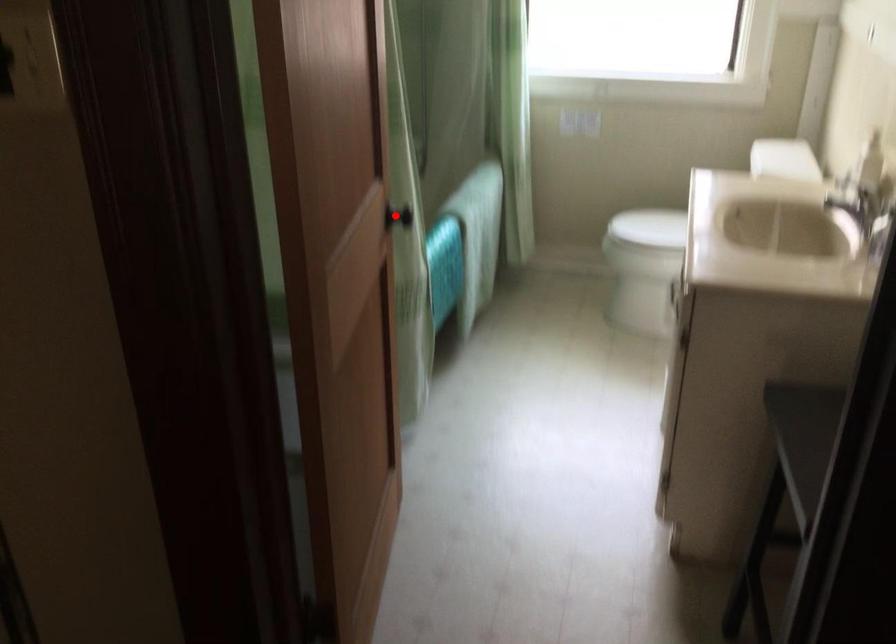
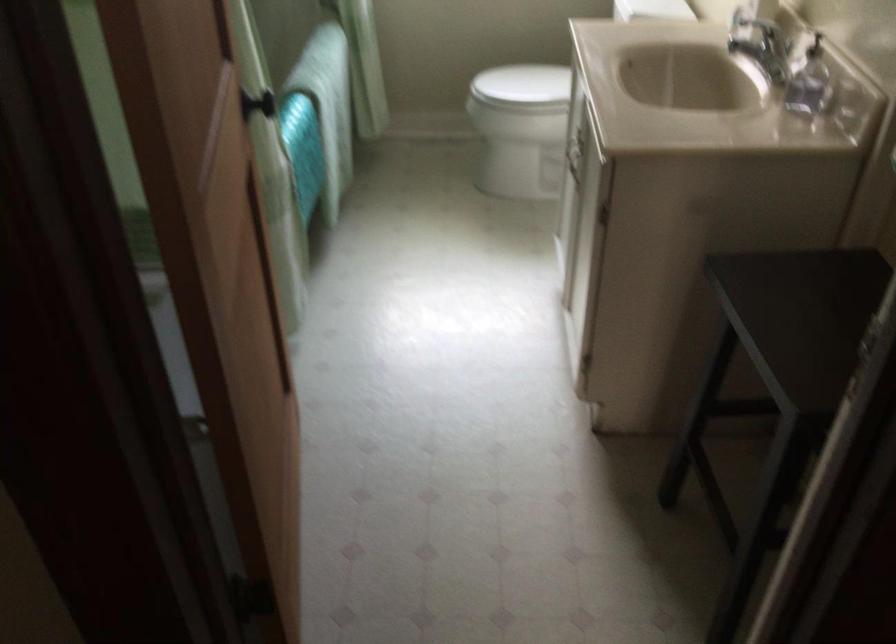
In the second image, find the point that corresponds to the highlighted location in the first image.

(256, 104)